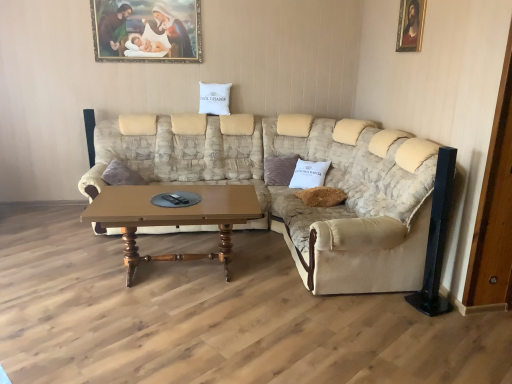
Identify the location of unoccupied region to the right of wooden polished coffee table at center. (x=282, y=288).